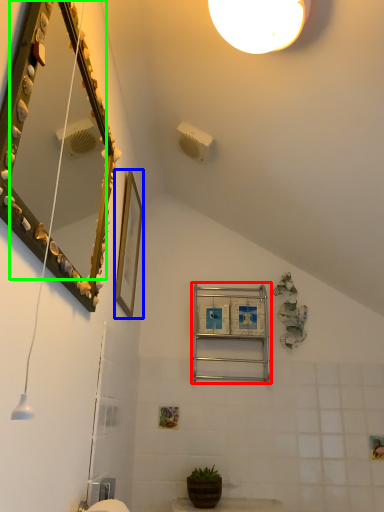
Question: Estimate the real-world distances between objects in this image. Which object is closer to ladder (highlighted by a red box), picture frame (highlighted by a blue box) or mirror (highlighted by a green box)?

Choices:
 (A) picture frame
 (B) mirror

Answer: (A)